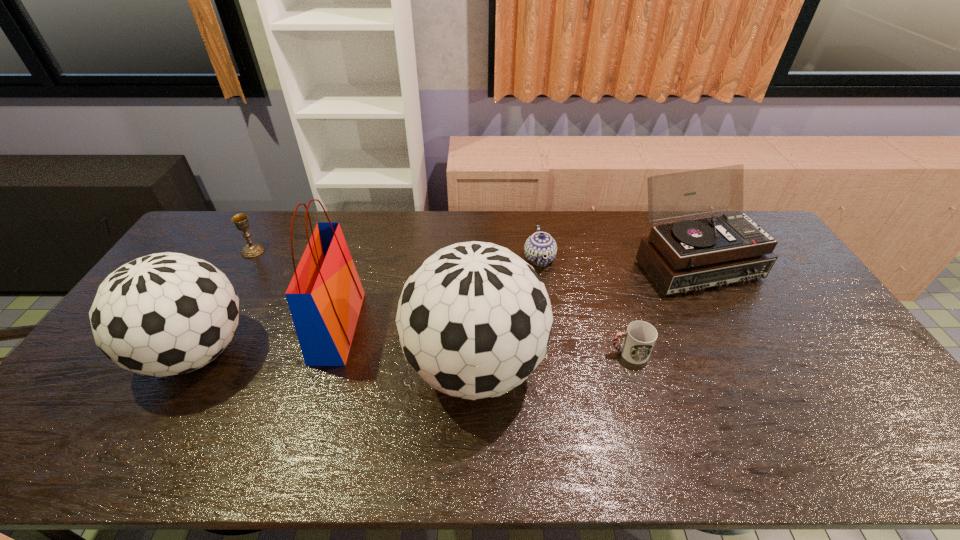
Locate an element on the screen. free region that satisfies the following two spatial constraints: 1. on the handle side of the rightmost object; 2. on the left side of the sixth object from left to right is located at coordinates (601, 262).

Locate an element on the screen. This screenshot has height=540, width=960. free point that satisfies the following two spatial constraints: 1. at the spout of the chinaware; 2. on the handle side of the shortest object is located at coordinates (554, 353).

Find the location of a particular element. This screenshot has height=540, width=960. vacant region that satisfies the following two spatial constraints: 1. at the spout of the record player; 2. on the left side of the second shortest object is located at coordinates (540, 262).